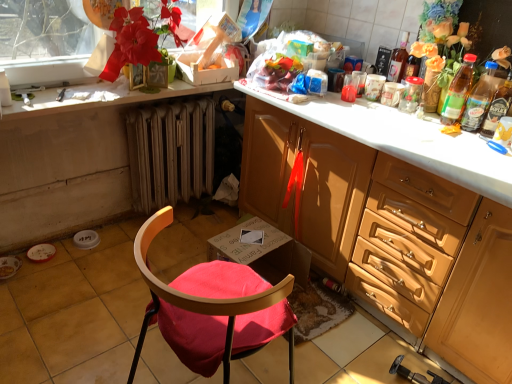
Image resolution: width=512 pixels, height=384 pixels. In order to click on unoccupied area in front of translucent plastic bottle at right, acting as the fourth bottle starting from the left in this screenshot , I will do `click(487, 147)`.